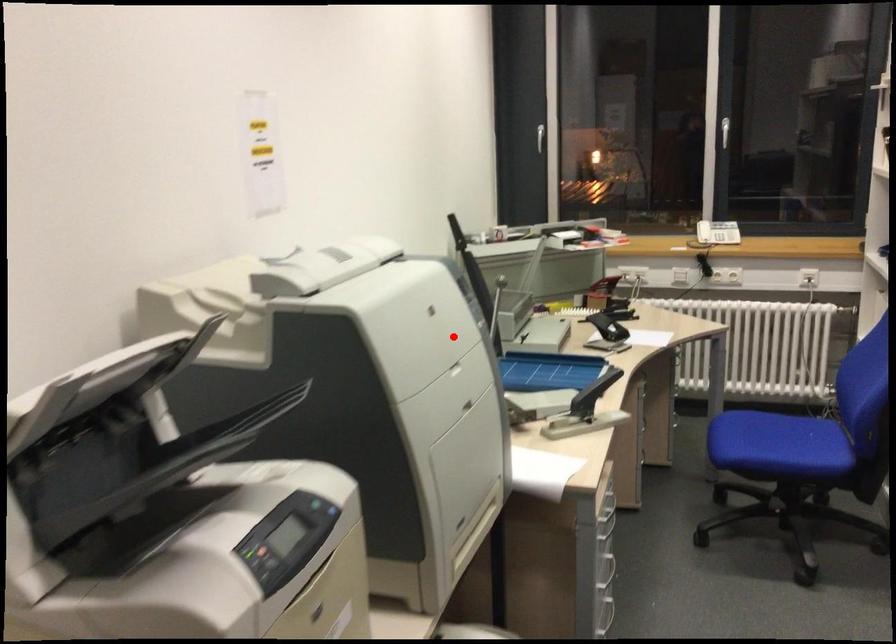
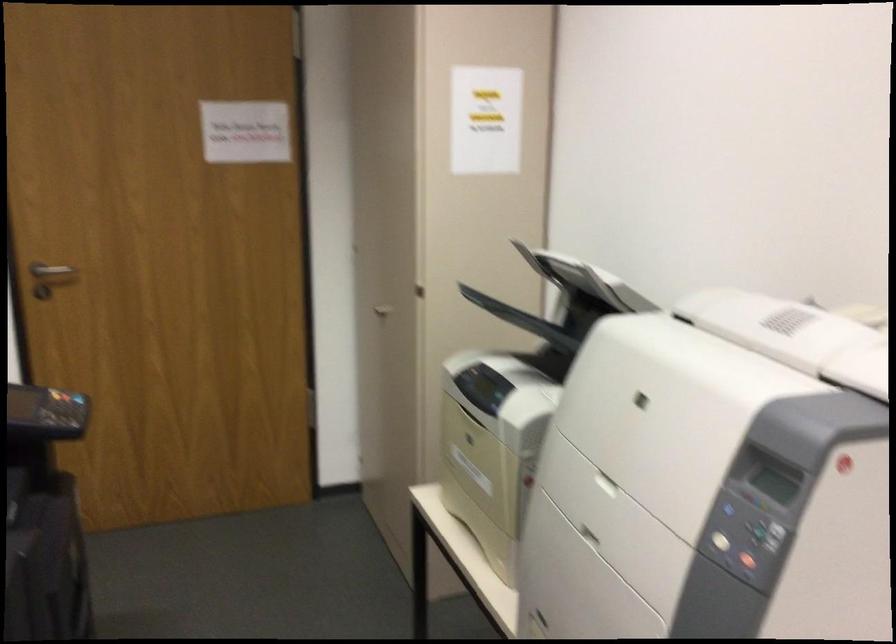
Question: I am providing you with two images of the same scene from different viewpoints. In image1, a red point is highlighted. Considering the same 3D point in image2, which of the following is correct?

Choices:
 (A) It is closer
 (B) It is farther

Answer: (A)